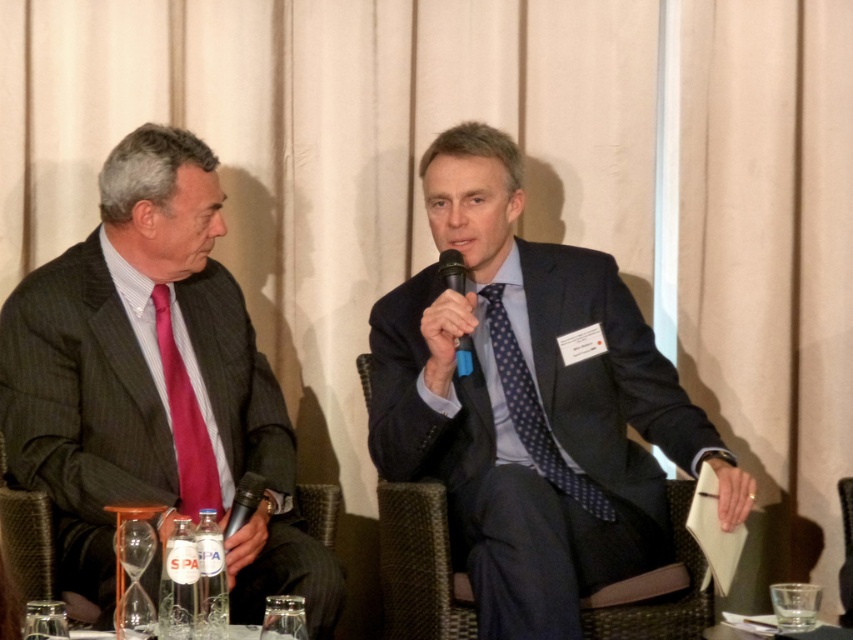
You are standing at the point labeled point (x=73, y=262). You want to move 1.5 meters forward. Will you collide with any object or person in the scene?

The distance between point (x=73, y=262) and the viewer is 2.20 meters. Moving 1.5 meters forward from point (x=73, y=262) would bring you to 0.70 meters away from the viewer, so you would collide with objects or people in the scene.

You are attending a formal event and notice two men seated at a conference table. You see the matte black suit at left and the matte red tie at left. Which object is positioned lower in the image?

The matte black suit at left is located below the matte red tie at left, so the matte black suit at left is positioned lower in the image.